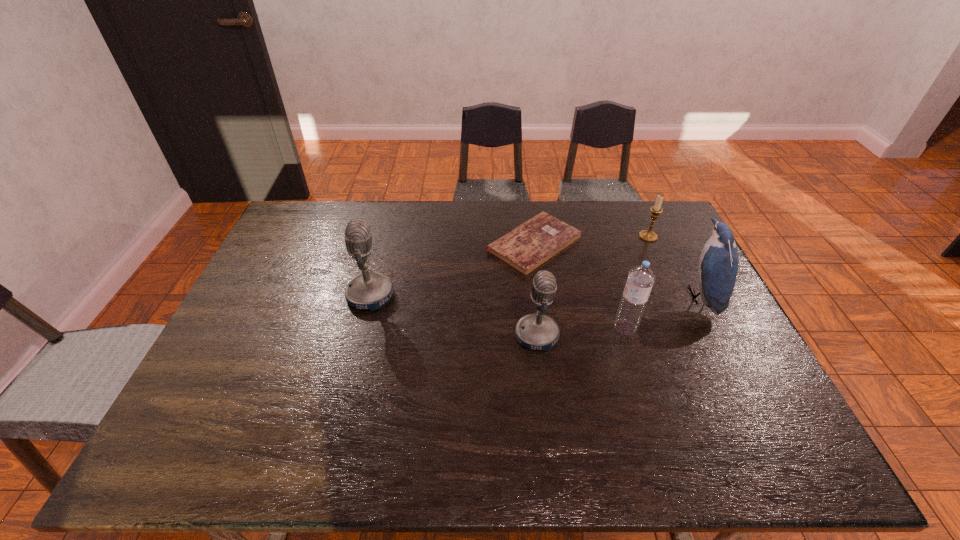
Identify the location of the taller microphone. (370, 290).

Locate an element on the screen. The image size is (960, 540). the farther microphone is located at coordinates (370, 290).

Locate an element on the screen. This screenshot has width=960, height=540. the right microphone is located at coordinates (537, 331).

At what (x,y) coordinates should I click in order to perform the action: click on the shorter microphone. Please return your answer as a coordinate pair (x, y). This screenshot has height=540, width=960. Looking at the image, I should click on (537, 331).

This screenshot has width=960, height=540. In order to click on candle holder in this screenshot , I will do `click(648, 235)`.

You are a GUI agent. You are given a task and a screenshot of the screen. Output one action in this format:
    pyautogui.click(x=<x>, y=<y>)
    Task: Click on the second object from right to left
    Image resolution: width=960 pixels, height=540 pixels.
    Given the screenshot: What is the action you would take?
    pyautogui.click(x=648, y=235)

The image size is (960, 540). I want to click on Bible, so click(525, 248).

Find the location of a particular element. the rightmost object is located at coordinates [x=718, y=263].

Where is `the fourth object from left to right`? This screenshot has height=540, width=960. the fourth object from left to right is located at coordinates (641, 278).

You are a GUI agent. You are given a task and a screenshot of the screen. Output one action in this format:
    pyautogui.click(x=<x>, y=<y>)
    Task: Click on the free spot located 0.320m on the front-facing side of the farther microphone
    
    Given the screenshot: What is the action you would take?
    pyautogui.click(x=501, y=295)